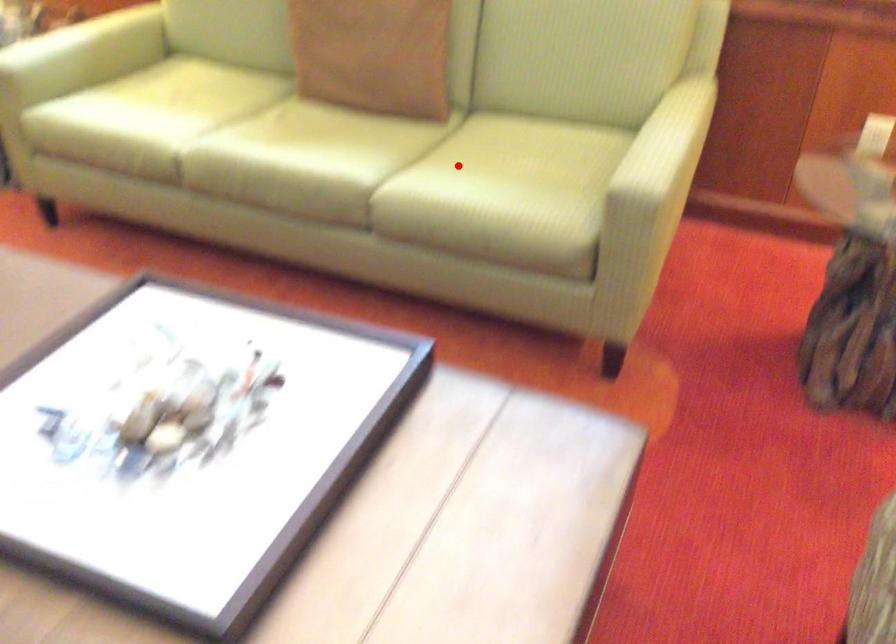
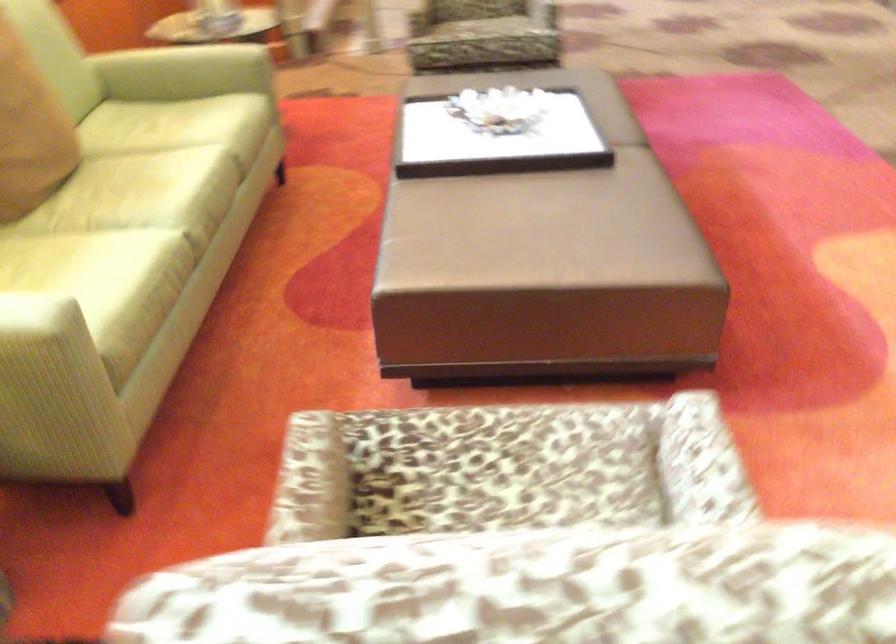
Question: A red point is marked in image1. In image2, is the corresponding 3D point closer to the camera or farther? Reply with the corresponding letter.

Choices:
 (A) The corresponding 3D point is closer.
 (B) The corresponding 3D point is farther.

Answer: (B)